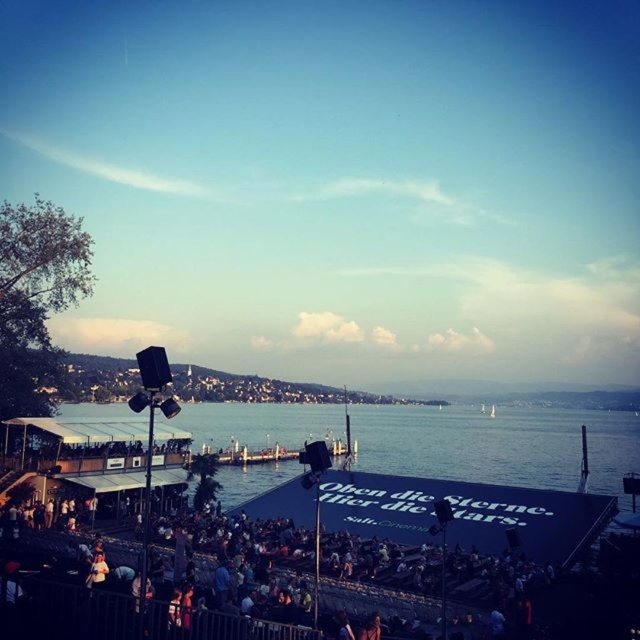
You are standing at point (483, 476) in the scene. What do you see directly in front of you?

At point (483, 476), you see blue water at lower center directly in front of you.

You are a photographer standing at the back of the dark gray crowd at lower center. You want to take a photo of the stage and the blue water at lower center. Which object is closer to you, and will you be able to see both in the same frame?

The dark gray crowd at lower center is closer to you than the blue water at lower center. Since the blue water at lower center is taller than the dark gray crowd at lower center, you might be able to see both in the same frame by adjusting your angle to include the top of the water above the crowd.

You are a photographer standing at the edge of the blue water at lower center. You want to take a photo of the dark gray crowd at lower center. Which direction should you move to frame them properly?

The blue water at lower center is positioned on the right side of dark gray crowd at lower center. To frame the dark gray crowd at lower center properly, you should move to the left side of the blue water at lower center.